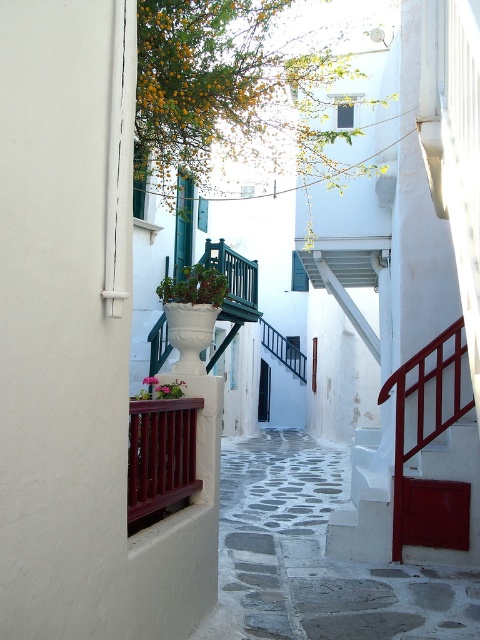
Consider the image. You are a painter standing in the alleyway and want to paint both the green matte planter at center and the metallic red railing at center. Which object should you focus on first if you want to paint the taller one first?

The metallic red railing at center is taller than the green matte planter at center, so you should focus on painting the metallic red railing at center first.

You are a painter who wants to paint both the wooden balustrade at lower left and the metallic red railing at center. Since you have limited time, you need to know which one is smaller in size to prioritize. Which object should you start with?

The wooden balustrade at lower left occupies less space than the metallic red railing at center, so you should start with the wooden balustrade at lower left as it is smaller in size.

You are a painter who wants to place a 1.2 meter tall easel in this alleyway. You see the wooden balustrade at lower left and the matte white pot at center. Which object is taller, and can the easel fit between them vertically?

The wooden balustrade at lower left is taller than the matte white pot at center. Since the easel is 1.2 meters tall, it can fit vertically between them as long as there is enough space between the two objects horizontally.